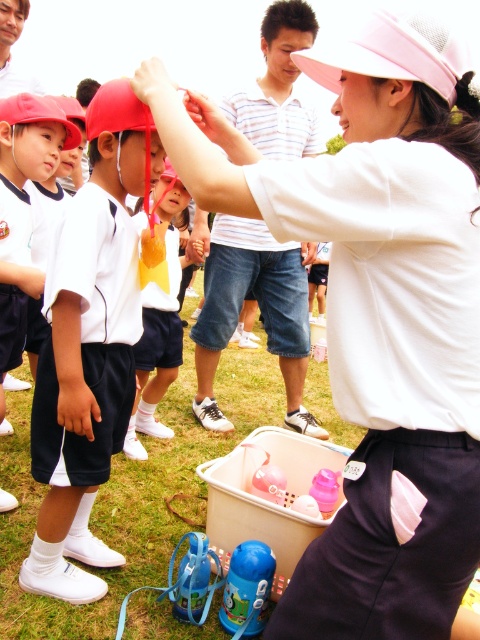
You are a teacher in the scene and need to quickly grab the blue plastic thermos at lower center before taking a photo with the camera. Can you reach the thermos and camera without moving more than 6 feet?

The blue plastic thermos at lower center and camera are 6.34 feet apart. Since the distance is slightly more than 6 feet, you would need to move more than 6 feet to reach both items.

You are a photographer trying to capture a clear shot of the white matte shirt at upper center and the matte yellow cap at center. Based on their heights, which object should you focus on first to ensure it doesn t get obscured by the other?

The white matte shirt at upper center is not as tall as the matte yellow cap at center, so you should focus on the white matte shirt at upper center first to prevent it from being obscured by the taller matte yellow cap at center.

You are a photographer trying to capture a clear shot of both the white matte visor at upper center and the white matte baseball cap at center. Since you want to ensure both are visible in the frame, which object should you focus on first to account for their sizes?

The white matte visor at upper center is wider than the white matte baseball cap at center, so you should focus on the white matte visor at upper center first to ensure it fits within the frame.